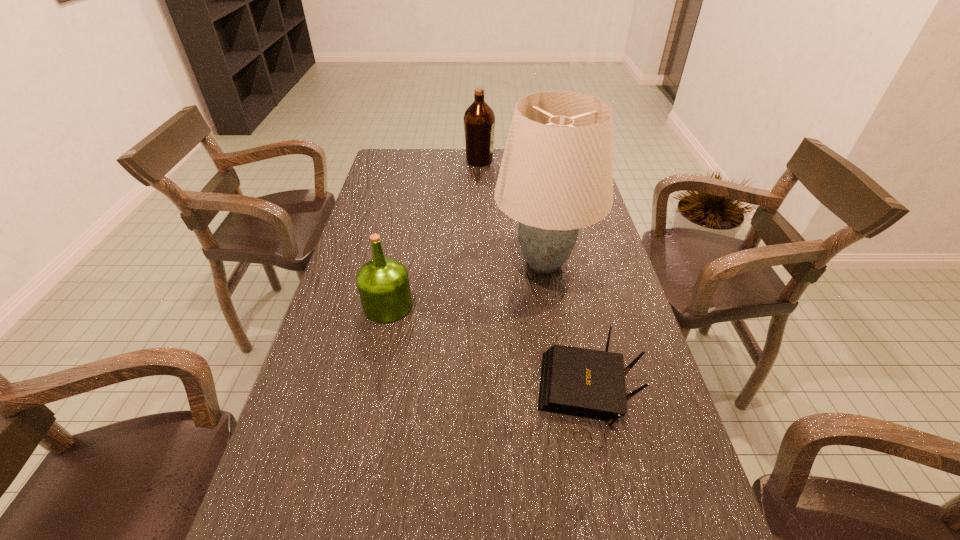
Locate an element on the screen. The height and width of the screenshot is (540, 960). free space between the router and the farther olive oil is located at coordinates (533, 276).

Find the location of `free spot between the lampshade and the leftmost object`. free spot between the lampshade and the leftmost object is located at coordinates (467, 284).

Where is `free spot between the tallest object and the router`? free spot between the tallest object and the router is located at coordinates (565, 327).

Image resolution: width=960 pixels, height=540 pixels. I want to click on object that is the closest to the router, so click(x=556, y=176).

I want to click on object that is the third closest to the right olive oil, so click(x=587, y=383).

At what (x,y) coordinates should I click in order to perform the action: click on vacant space that satisfies the following two spatial constraints: 1. on the label of the third shortest object; 2. on the left side of the tallest object. Please return your answer as a coordinate pair (x, y). Looking at the image, I should click on (479, 262).

The image size is (960, 540). I want to click on free space that satisfies the following two spatial constraints: 1. on the label of the nearest object; 2. on the right side of the taller olive oil, so click(x=479, y=391).

Locate an element on the screen. Image resolution: width=960 pixels, height=540 pixels. vacant space that satisfies the following two spatial constraints: 1. on the front side of the shortest object; 2. on the left side of the lampshade is located at coordinates (566, 391).

This screenshot has height=540, width=960. What are the coordinates of `vacant space that satisfies the following two spatial constraints: 1. on the label of the farther olive oil; 2. on the left side of the router` in the screenshot? It's located at (479, 391).

I want to click on vacant space that satisfies the following two spatial constraints: 1. on the label of the router; 2. on the left side of the farther olive oil, so click(479, 391).